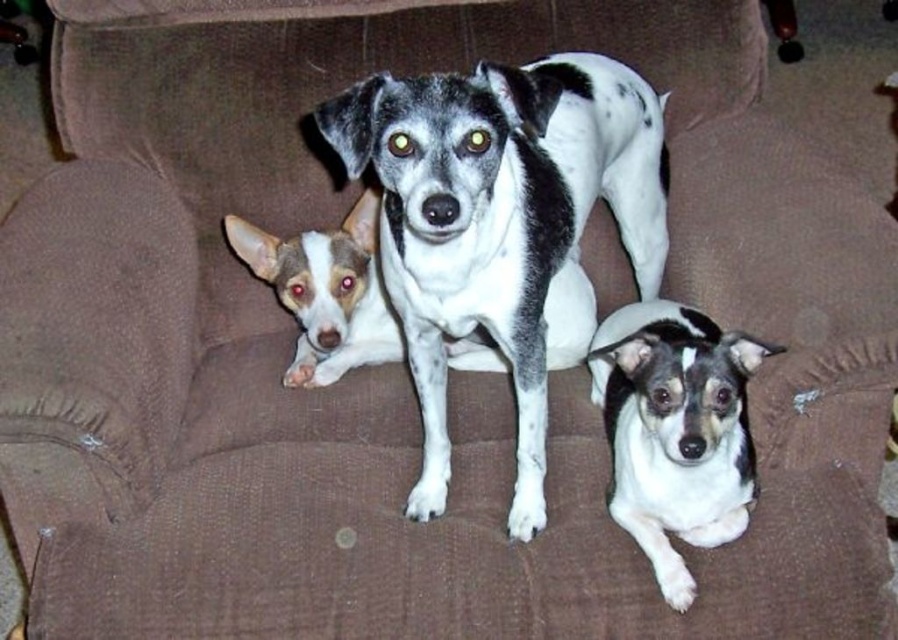
You are a photographer setting up a photo shoot for the three dogs on the couch. You need to position a small stool behind the white and black fur dog at center and the white and gray fur dog at center so that both dogs can sit comfortably. Based on their heights, which dog requires the taller stool?

The white and black fur dog at center is taller than the white and gray fur dog at center, so the white and black fur dog at center requires the taller stool to sit comfortably.